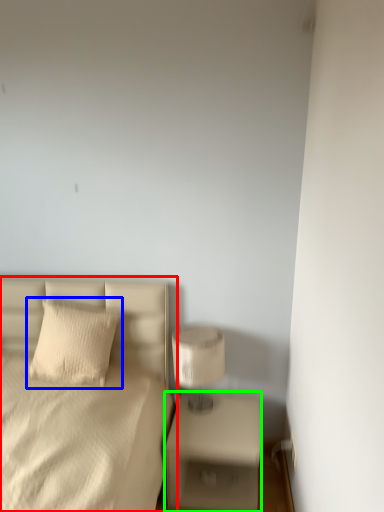
Question: Which object is positioned farthest from bed (highlighted by a red box)? Select from pillow (highlighted by a blue box) and nightstand (highlighted by a green box).

Choices:
 (A) pillow
 (B) nightstand

Answer: (B)